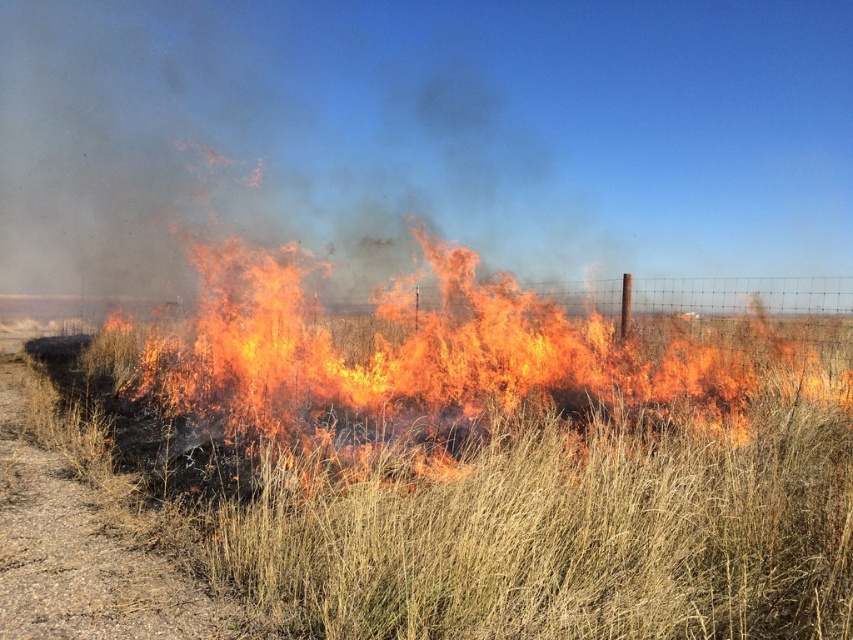
Looking at this image, is flaming grass at center shorter than brown gravel road at lower left?

No, flaming grass at center is not shorter than brown gravel road at lower left.

Find the location of a particular element. flaming grass at center is located at coordinates (461, 358).

Which is in front, point (489, 388) or point (113, 600)?

Positioned in front is point (113, 600).

Find the location of `flaming grass at center`. flaming grass at center is located at coordinates (461, 358).

Who is shorter, grassy field at center or flaming grass at center?

grassy field at center is shorter.

Is point (825, 582) positioned after point (360, 333)?

No, (825, 582) is in front of (360, 333).

At what (x,y) coordinates should I click in order to perform the action: click on grassy field at center. Please return your answer as a coordinate pair (x, y). The width and height of the screenshot is (853, 640). Looking at the image, I should click on (492, 509).

Is grassy field at center closer to camera compared to brown gravel road at lower left?

Yes, it is in front of brown gravel road at lower left.

Does point (741, 531) come behind point (90, 508)?

No, (741, 531) is in front of (90, 508).

Is point (775, 458) positioned in front of point (136, 564)?

No, it is behind (136, 564).

I want to click on grassy field at center, so click(x=492, y=509).